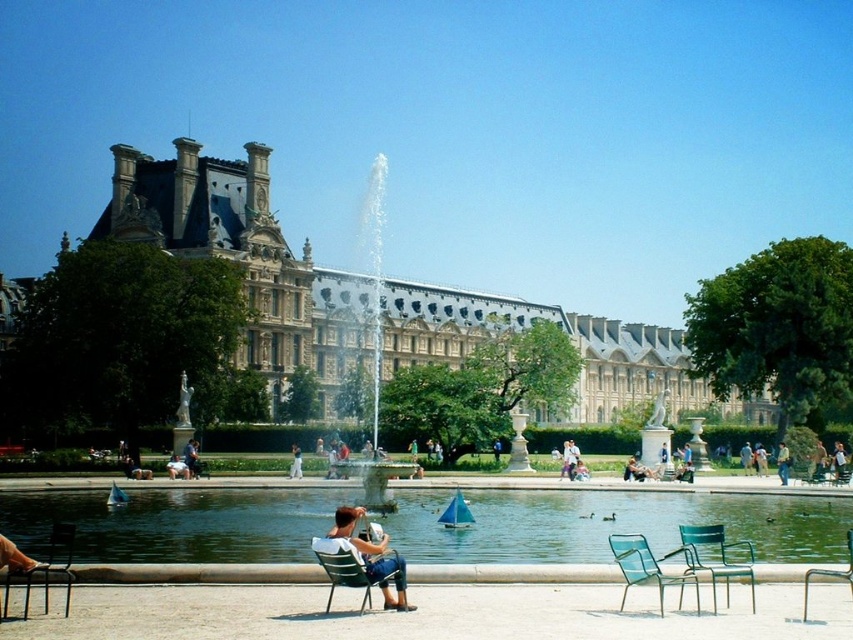
You are standing at the point with coordinates point [712,531] in the park scene. You want to walk to the point with coordinates point [386,474]. Which direction should you move relative to the grand classical building in the background?

Point [386,474] is behind point [712,531] relative to the grand classical building in the background, so you should move towards the direction away from the building to reach your destination.